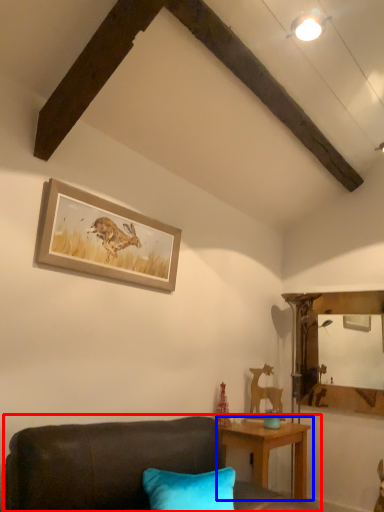
Question: Which point is further to the camera, studio couch (highlighted by a red box) or table (highlighted by a blue box)?

Choices:
 (A) studio couch
 (B) table

Answer: (B)